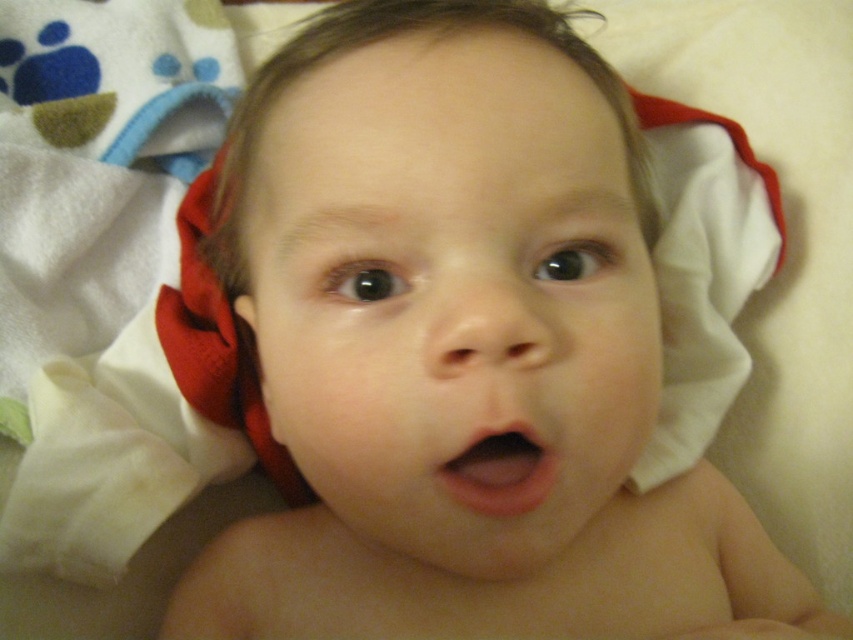
Can you confirm if pink smooth flesh at center is thinner than soft fabric ear at lower left?

Incorrect, pink smooth flesh at center's width is not less than soft fabric ear at lower left's.

Does point (444, 476) come farther from viewer compared to point (244, 371)?

No, it is in front of (244, 371).

This screenshot has width=853, height=640. Identify the location of pink smooth flesh at center. (500, 470).